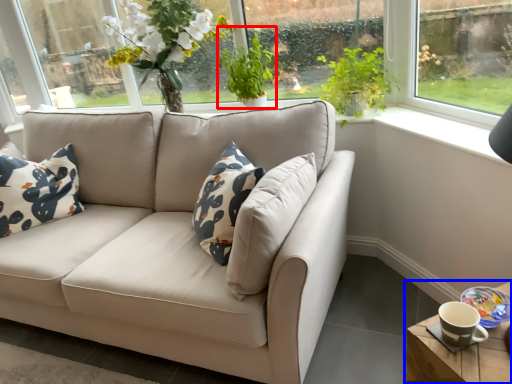
Question: Which object appears closest to the camera in this image, plant (highlighted by a red box) or table (highlighted by a blue box)?

Choices:
 (A) plant
 (B) table

Answer: (B)